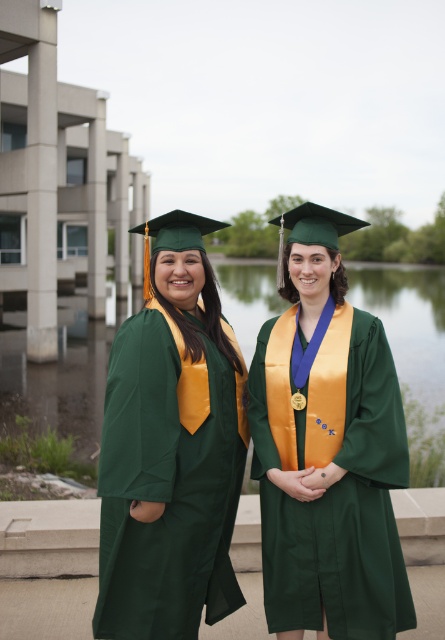
Question: Does green matte graduation gown at center appear over green matte graduation gown at left?

Choices:
 (A) no
 (B) yes

Answer: (B)

Question: Which object is farther from the camera taking this photo?

Choices:
 (A) green fabric lake at center
 (B) green matte graduation gown at center

Answer: (A)

Question: Which point is closer to the camera taking this photo?

Choices:
 (A) (319, 545)
 (B) (377, 296)
 (C) (191, 579)

Answer: (A)

Question: Can you confirm if green matte graduation gown at center is positioned to the left of green matte graduation gown at left?

Choices:
 (A) no
 (B) yes

Answer: (A)

Question: Is green matte graduation gown at center to the left of green matte graduation gown at left from the viewer's perspective?

Choices:
 (A) no
 (B) yes

Answer: (A)

Question: Based on their relative distances, which object is nearer to the green matte graduation gown at center?

Choices:
 (A) green fabric lake at center
 (B) green matte graduation gown at left

Answer: (B)